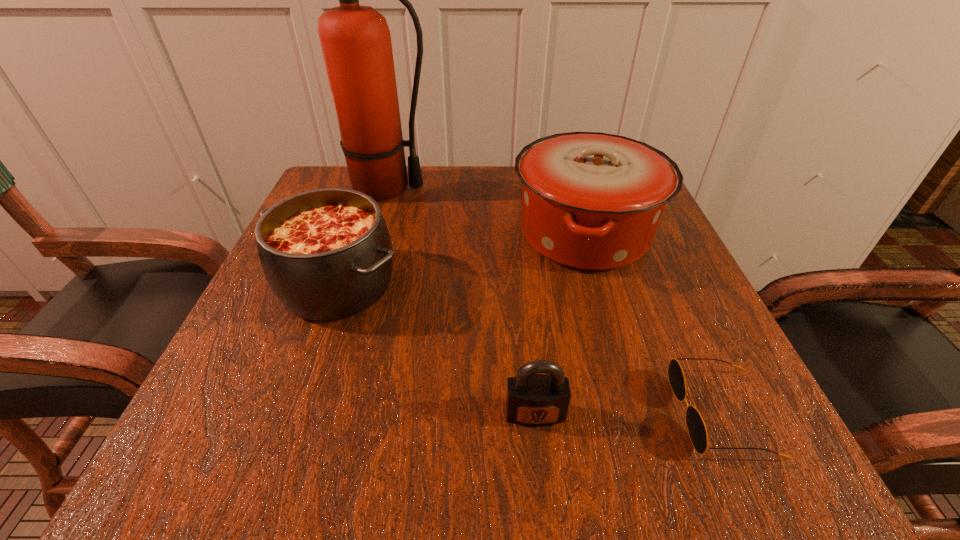
At what (x,y) coordinates should I click in order to perform the action: click on casserole that is at the right edge. Please return your answer as a coordinate pair (x, y). Looking at the image, I should click on (592, 201).

Identify the location of sunglasses located in the right edge section of the desktop. The width and height of the screenshot is (960, 540). (696, 427).

Locate an element on the screen. This screenshot has height=540, width=960. object located in the far left corner section of the desktop is located at coordinates (356, 43).

Find the location of a particular element. The image size is (960, 540). object at the far right corner is located at coordinates (592, 201).

The image size is (960, 540). What are the coordinates of `object that is at the near right corner` in the screenshot? It's located at (696, 427).

Find the location of a particular element. Image resolution: width=960 pixels, height=540 pixels. blank space at the far edge of the desktop is located at coordinates (482, 201).

This screenshot has height=540, width=960. What are the coordinates of `vacant space at the near edge of the desktop` in the screenshot? It's located at (535, 475).

This screenshot has height=540, width=960. Find the location of `blank space at the right edge`. blank space at the right edge is located at coordinates (636, 333).

Where is `vacant space at the near left corner of the desktop`? vacant space at the near left corner of the desktop is located at coordinates (x=221, y=447).

This screenshot has height=540, width=960. I want to click on free point between the fourth shortest object and the tallest object, so click(486, 211).